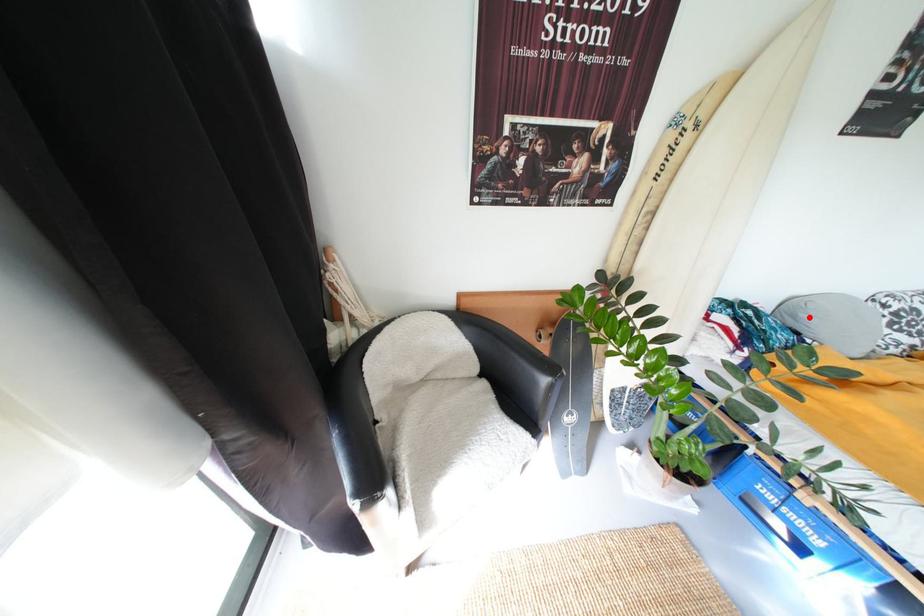
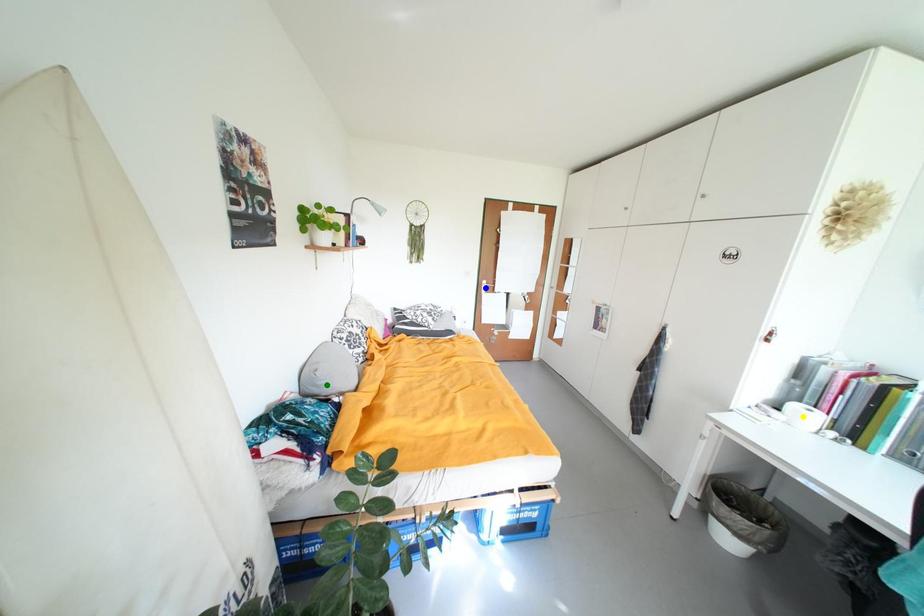
Question: I am providing you with two images of the same scene from different viewpoints. A red point is marked on the first image. You are given multiple points on the second image. Which spot in image 2 lines up with the point in image 1?

Choices:
 (A) yellow point
 (B) blue point
 (C) green point

Answer: (C)